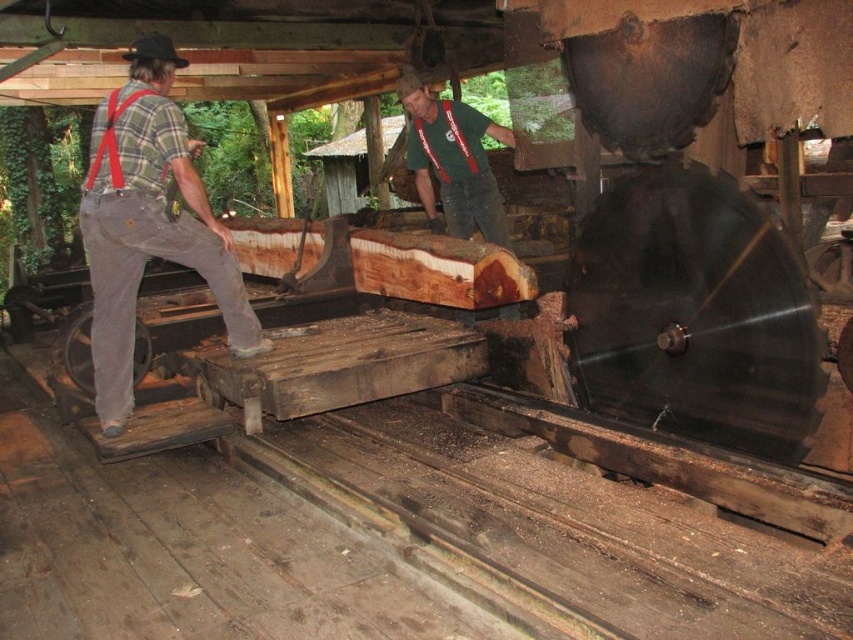
You are a visitor observing the workers at the sawmill. You notice two workers wearing the plaid flannel shirt at left and the green fabric shirt at center. Which worker is standing nearer to you?

The plaid flannel shirt at left is closer to the viewer than the green fabric shirt at center, so the worker in the plaid flannel shirt at left is standing nearer to you.